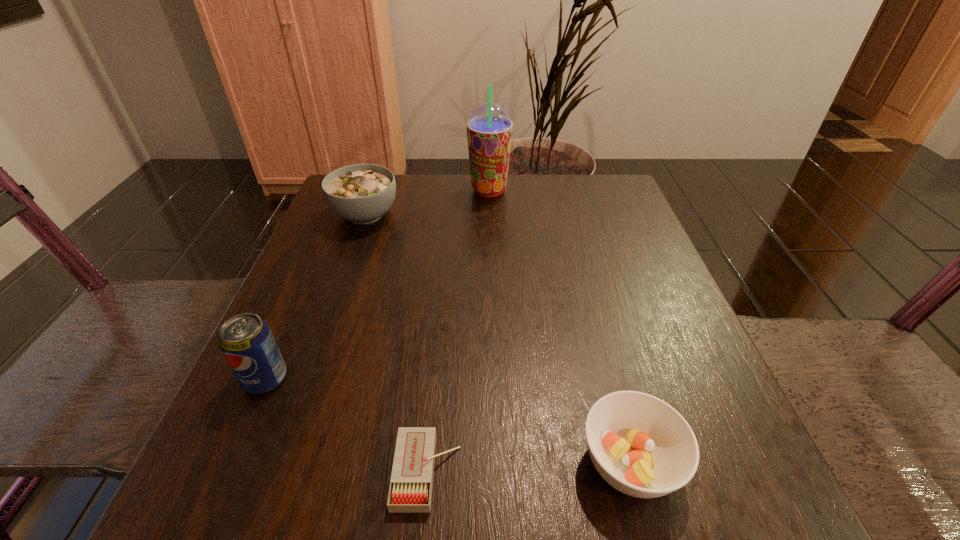
This screenshot has height=540, width=960. What are the coordinates of `the tallest object` in the screenshot? It's located at (489, 127).

This screenshot has width=960, height=540. Find the location of `the second tallest object`. the second tallest object is located at coordinates (246, 340).

Identify the location of soda. This screenshot has width=960, height=540. (246, 340).

At what (x,y) coordinates should I click in order to perform the action: click on the farther soup bowl. Please return your answer as a coordinate pair (x, y). Looking at the image, I should click on [361, 193].

This screenshot has height=540, width=960. In order to click on the left soup bowl in this screenshot , I will do `click(361, 193)`.

You are a GUI agent. You are given a task and a screenshot of the screen. Output one action in this format:
    pyautogui.click(x=<x>, y=<y>)
    Task: Click on the right soup bowl
    
    Given the screenshot: What is the action you would take?
    pyautogui.click(x=640, y=445)

This screenshot has width=960, height=540. In order to click on the nearer soup bowl in this screenshot , I will do `click(640, 445)`.

This screenshot has width=960, height=540. What are the coordinates of `matchbox` in the screenshot? It's located at (410, 491).

Where is `free location located 0.200m on the front of the smoothie`? free location located 0.200m on the front of the smoothie is located at coordinates (491, 252).

Where is `free location located 0.350m on the back of the soda`? This screenshot has width=960, height=540. free location located 0.350m on the back of the soda is located at coordinates (329, 235).